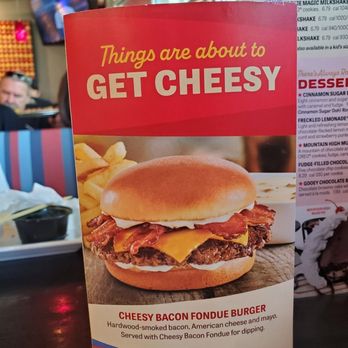
At what (x,y) coordinates should I click in order to perform the action: click on table. Please return your answer as a coordinate pair (x, y). This screenshot has height=348, width=348. Looking at the image, I should click on (55, 324).